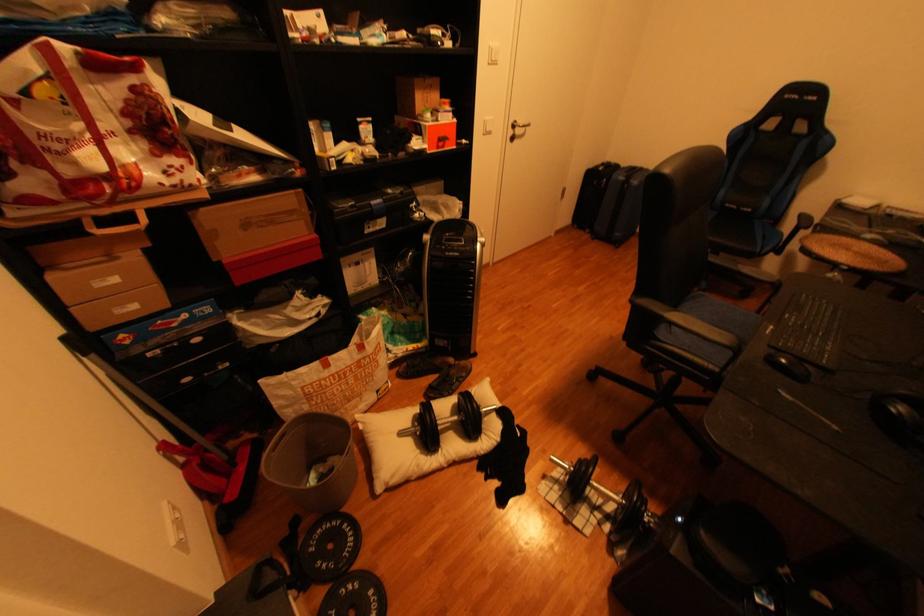
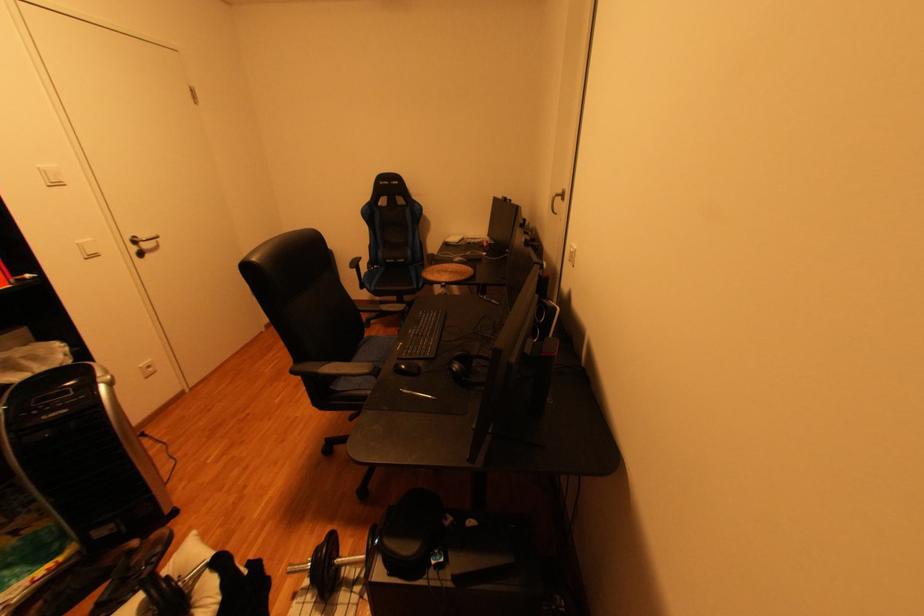
Locate, in the second image, the point that corresponds to (793,361) in the first image.

(411, 367)